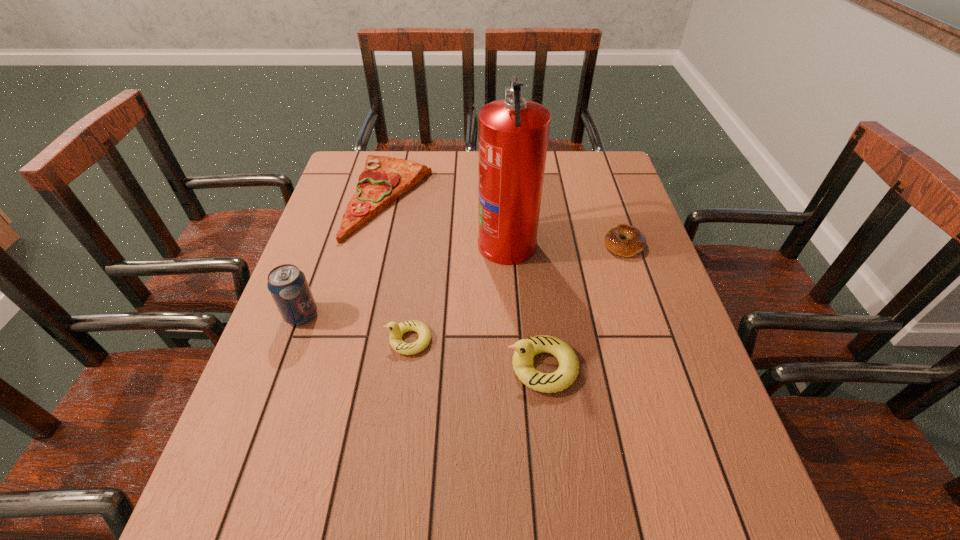
Where is `object positioned at the far edge`? This screenshot has height=540, width=960. object positioned at the far edge is located at coordinates (383, 180).

The height and width of the screenshot is (540, 960). I want to click on pizza situated at the left edge, so click(x=383, y=180).

The width and height of the screenshot is (960, 540). Find the location of `pop soda located in the left edge section of the desktop`. pop soda located in the left edge section of the desktop is located at coordinates (288, 286).

Where is `object at the right edge`? This screenshot has width=960, height=540. object at the right edge is located at coordinates (635, 242).

Find the location of a particular element. This screenshot has height=540, width=960. object at the far left corner is located at coordinates [383, 180].

Image resolution: width=960 pixels, height=540 pixels. What are the coordinates of `free spot at the far edge of the desktop` in the screenshot? It's located at (404, 158).

In the image, there is a desktop. At what (x,y) coordinates should I click in order to perform the action: click on free space at the left edge. Please return your answer as a coordinate pair (x, y). The height and width of the screenshot is (540, 960). Looking at the image, I should click on (260, 371).

Find the location of a particular element. This screenshot has height=540, width=960. vacant space at the right edge of the desktop is located at coordinates (620, 328).

Where is `free space at the far right corner`? Image resolution: width=960 pixels, height=540 pixels. free space at the far right corner is located at coordinates (585, 190).

Find the location of `free space at the near right corner of the desktop`. free space at the near right corner of the desktop is located at coordinates (723, 437).